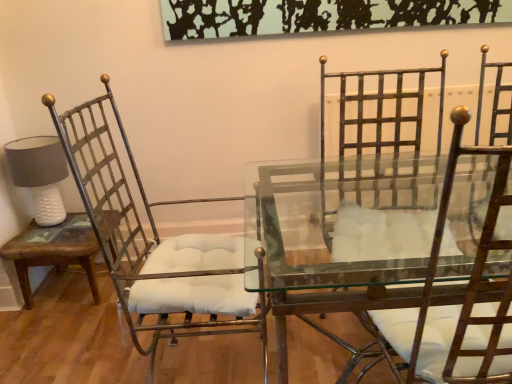
At what (x,y) coordinates should I click in order to perform the action: click on clear glass table at center. Please return your answer as a coordinate pair (x, y). Looking at the image, I should click on (335, 211).

Looking at this image, in order to face brown wood side table at left, should I rotate leftwards or rightwards?

Turn left by 23.581 degrees to look at brown wood side table at left.

You are a GUI agent. You are given a task and a screenshot of the screen. Output one action in this format:
    pyautogui.click(x=<x>, y=<y>)
    Task: Click on the metallic iron chair at right, the second chair when ordered from left to right
    This screenshot has width=512, height=384.
    Given the screenshot: What is the action you would take?
    pyautogui.click(x=456, y=305)

Does brown wood side table at left have a greater width compared to metallic iron chair at right, the second chair when ordered from left to right?

No.

Does point (95, 281) appear closer or farther from the camera than point (394, 309)?

Point (95, 281).

Who is smaller, brown wood side table at left or metallic iron chair at right, the second chair when ordered from left to right?

With smaller size is brown wood side table at left.

Is the position of brown wood side table at left more distant than that of metallic iron chair at right, the second chair when ordered from left to right?

Yes, brown wood side table at left is further from the viewer.

From a real-world perspective, is clear glass table at center below brown wood side table at left?

No.

From the image's perspective, which is below, clear glass table at center or brown wood side table at left?

clear glass table at center appears lower in the image.

Looking at their sizes, would you say clear glass table at center is wider or thinner than brown wood side table at left?

Considering their sizes, clear glass table at center looks broader than brown wood side table at left.

From a real-world perspective, who is located lower, metallic white cushioned chair at left, placed as the 1th chair when sorted from left to right, or brown wood side table at left?

brown wood side table at left is physically lower.

Is metallic white cushioned chair at left, the 2th chair from the right, not near brown wood side table at left?

No, metallic white cushioned chair at left, the 2th chair from the right, is in close proximity to brown wood side table at left.

Is metallic white cushioned chair at left, placed as the 1th chair when sorted from left to right, positioned in front of brown wood side table at left?

Yes, metallic white cushioned chair at left, placed as the 1th chair when sorted from left to right, is closer to the camera.

Is metallic white cushioned chair at left, placed as the 1th chair when sorted from left to right, oriented away from brown wood side table at left?

No, metallic white cushioned chair at left, placed as the 1th chair when sorted from left to right, is not facing the opposite direction of brown wood side table at left.

Does clear glass table at center turn towards metallic white cushioned chair at left, the 2th chair from the right?

No, clear glass table at center is not facing towards metallic white cushioned chair at left, the 2th chair from the right.

Which is behind, point (396, 192) or point (81, 160)?

The point (81, 160) is farther.

Can you confirm if clear glass table at center is bigger than metallic white cushioned chair at left, placed as the 1th chair when sorted from left to right?

Yes.

Is clear glass table at center touching metallic white cushioned chair at left, the 2th chair from the right?

No, clear glass table at center is not beside metallic white cushioned chair at left, the 2th chair from the right.

From the image's perspective, is brown wood side table at left located above or below white textured lampshade at left?

Based on their image positions, brown wood side table at left is located beneath white textured lampshade at left.

Locate an element on the screen. table in front of the white textured lampshade at left is located at coordinates (54, 251).

Is brown wood side table at left aimed at white textured lampshade at left?

No.

From a real-world perspective, which object stands above the other?

white textured lampshade at left is physically above.

Measure the distance between white textured lampshade at left and metallic iron chair at right, arranged as the first chair when viewed from the right.

white textured lampshade at left and metallic iron chair at right, arranged as the first chair when viewed from the right, are 5.55 feet apart from each other.

Considering the relative positions of white textured lampshade at left and metallic iron chair at right, arranged as the first chair when viewed from the right, in the image provided, is white textured lampshade at left to the left or to the right of metallic iron chair at right, arranged as the first chair when viewed from the right,?

white textured lampshade at left is positioned on metallic iron chair at right, arranged as the first chair when viewed from the right,'s left side.

Which chair is the 2nd one when counting from the front of the white textured lampshade at left? Please provide its 2D coordinates.

[(456, 305)]

From their relative heights in the image, would you say metallic white cushioned chair at left, the 2th chair from the right, is taller or shorter than white textured lampshade at left?

In the image, metallic white cushioned chair at left, the 2th chair from the right, appears to be taller than white textured lampshade at left.

Is metallic white cushioned chair at left, placed as the 1th chair when sorted from left to right, wider or thinner than white textured lampshade at left?

Considering their sizes, metallic white cushioned chair at left, placed as the 1th chair when sorted from left to right, looks broader than white textured lampshade at left.

From a real-world perspective, who is located higher, metallic white cushioned chair at left, the 2th chair from the right, or white textured lampshade at left?

white textured lampshade at left.

Considering the points (99, 177) and (62, 168), which point is behind, point (99, 177) or point (62, 168)?

Point (62, 168)

Image resolution: width=512 pixels, height=384 pixels. Identify the location of table that appears below the metallic iron chair at right, arranged as the first chair when viewed from the right (from a real-world perspective). (54, 251).

At what (x,y) coordinates should I click in order to perform the action: click on round table lying on the right of brown wood side table at left. Please return your answer as a coordinate pair (x, y). This screenshot has height=384, width=512. Looking at the image, I should click on coord(335,211).

Based on the photo, looking at the image, which one is located further to white textured lampshade at left, brown wood side table at left or metallic white cushioned chair at left, placed as the 1th chair when sorted from left to right?

Among the two, metallic white cushioned chair at left, placed as the 1th chair when sorted from left to right, is located further to white textured lampshade at left.

Which object lies nearer to the anchor point metallic iron chair at right, the second chair when ordered from left to right, brown wood side table at left or metallic white cushioned chair at left, placed as the 1th chair when sorted from left to right?

metallic white cushioned chair at left, placed as the 1th chair when sorted from left to right, lies closer to metallic iron chair at right, the second chair when ordered from left to right, than the other object.

Looking at the image, which one is located closer to metallic white cushioned chair at left, placed as the 1th chair when sorted from left to right, clear glass table at center or brown wood side table at left?

clear glass table at center lies closer to metallic white cushioned chair at left, placed as the 1th chair when sorted from left to right, than the other object.

When comparing their distances from metallic white cushioned chair at left, placed as the 1th chair when sorted from left to right, does clear glass table at center or metallic iron chair at right, the second chair when ordered from left to right, seem closer?

Among the two, clear glass table at center is located nearer to metallic white cushioned chair at left, placed as the 1th chair when sorted from left to right.

Based on their spatial positions, is metallic white cushioned chair at left, placed as the 1th chair when sorted from left to right, or white textured lampshade at left closer to metallic iron chair at right, arranged as the first chair when viewed from the right?

metallic white cushioned chair at left, placed as the 1th chair when sorted from left to right, is closer to metallic iron chair at right, arranged as the first chair when viewed from the right.

Looking at this image, when comparing their distances from metallic white cushioned chair at left, placed as the 1th chair when sorted from left to right, does white textured lampshade at left or clear glass table at center seem further?

Among the two, white textured lampshade at left is located further to metallic white cushioned chair at left, placed as the 1th chair when sorted from left to right.

Based on their spatial positions, is brown wood side table at left or metallic white cushioned chair at left, the 2th chair from the right, closer to clear glass table at center?

The object closer to clear glass table at center is metallic white cushioned chair at left, the 2th chair from the right.

When comparing their distances from metallic white cushioned chair at left, the 2th chair from the right, does brown wood side table at left or metallic iron chair at right, arranged as the first chair when viewed from the right, seem further?

The object further to metallic white cushioned chair at left, the 2th chair from the right, is metallic iron chair at right, arranged as the first chair when viewed from the right.

Where is `table between white textured lampshade at left and clear glass table at center from left to right`? This screenshot has height=384, width=512. table between white textured lampshade at left and clear glass table at center from left to right is located at coordinates (54, 251).

I want to click on chair situated between brown wood side table at left and clear glass table at center from left to right, so click(x=153, y=242).

You are a GUI agent. You are given a task and a screenshot of the screen. Output one action in this format:
    pyautogui.click(x=<x>, y=<y>)
    Task: Click on the round table located between metallic white cushioned chair at left, placed as the 1th chair when sorted from left to right, and metallic iron chair at right, arranged as the first chair when viewed from the right, in the left-right direction
    
    Given the screenshot: What is the action you would take?
    pyautogui.click(x=335, y=211)

Locate an element on the screen. The width and height of the screenshot is (512, 384). table between white textured lampshade at left and metallic iron chair at right, the second chair when ordered from left to right, in the horizontal direction is located at coordinates (54, 251).